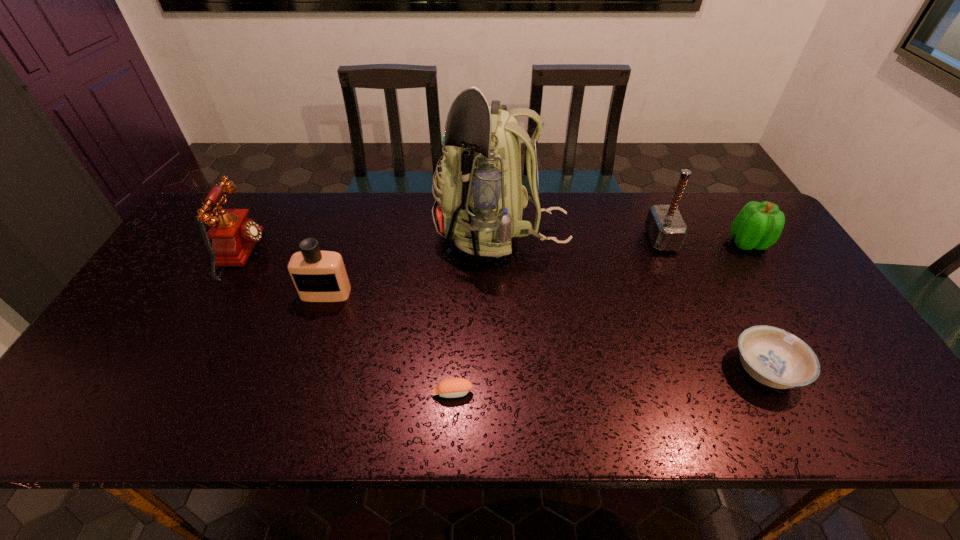
The height and width of the screenshot is (540, 960). I want to click on vacant position in the image that satisfies the following two spatial constraints: 1. on the back side of the second shortest object; 2. on the left side of the rightmost object, so click(x=700, y=243).

Find the location of a particular element. The image size is (960, 540). free spot that satisfies the following two spatial constraints: 1. on the front-facing side of the backpack; 2. on the front label of the second object from left to right is located at coordinates (504, 293).

Identify the location of vacant space that satisfies the following two spatial constraints: 1. on the back side of the rightmost object; 2. on the front-facing side of the backpack. The width and height of the screenshot is (960, 540). (743, 236).